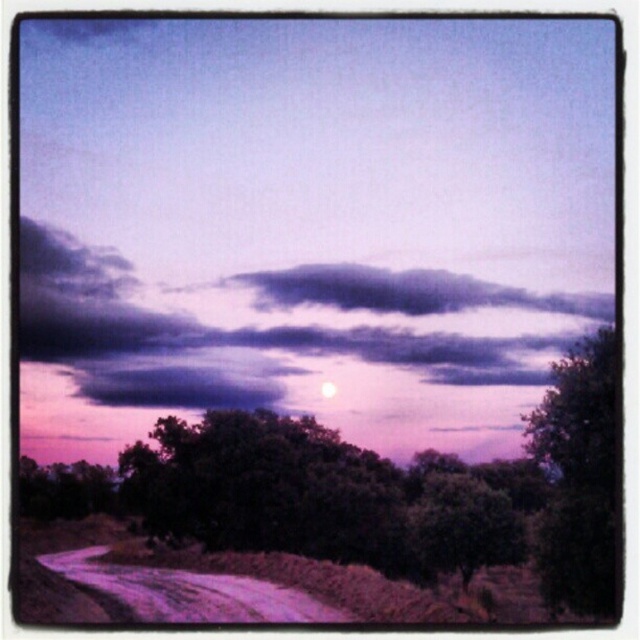
Question: Which of the following is the closest to the observer?

Choices:
 (A) (262, 609)
 (B) (259, 369)

Answer: (A)

Question: Which of the following is the closest to the observer?

Choices:
 (A) white glossy moon at center
 (B) green leafy tree at center

Answer: (B)

Question: Which object appears closest to the camera in this image?

Choices:
 (A) dark green leafy tree at right
 (B) dark purple cloud at upper center
 (C) green leafy tree at center

Answer: (C)

Question: Does dark green leafy tree at right have a greater width compared to white glossy moon at center?

Choices:
 (A) no
 (B) yes

Answer: (B)

Question: Does dark purple cloud at upper center come in front of dark green leafy tree at right?

Choices:
 (A) no
 (B) yes

Answer: (A)

Question: Can you confirm if dark green leafy tree at right is positioned to the left of purple dirt track at lower left?

Choices:
 (A) yes
 (B) no

Answer: (B)